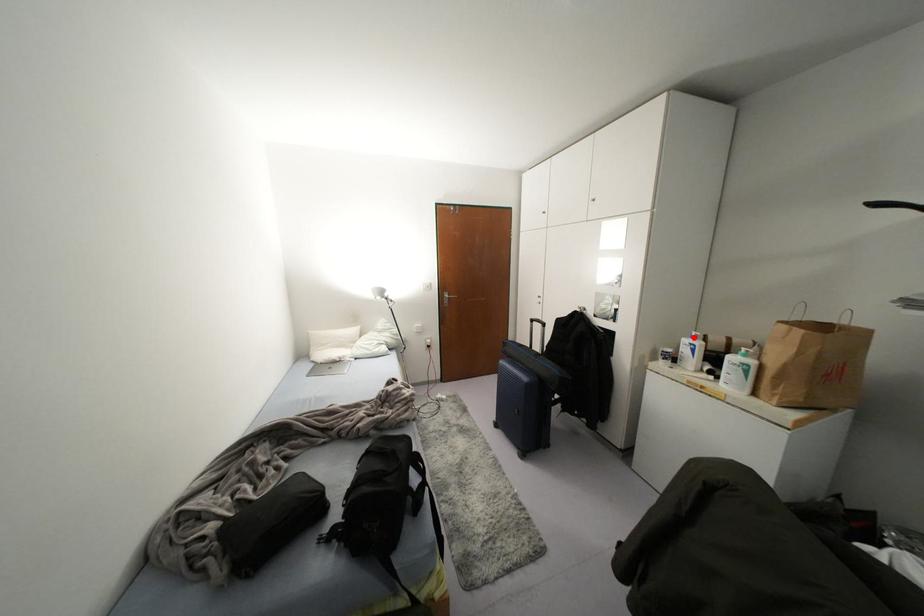
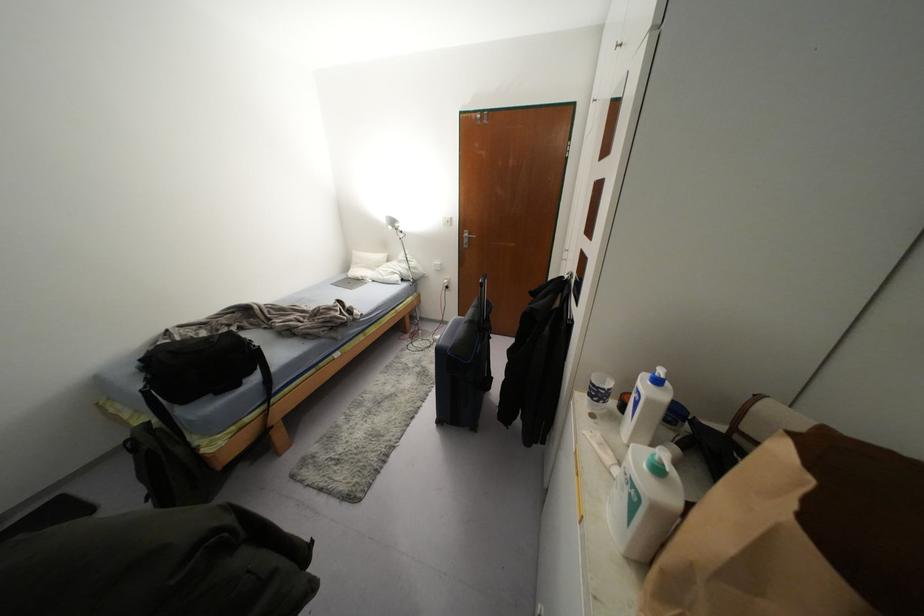
The point at the highlighted location is marked in the first image. Where is the corresponding point in the second image?

(658, 381)